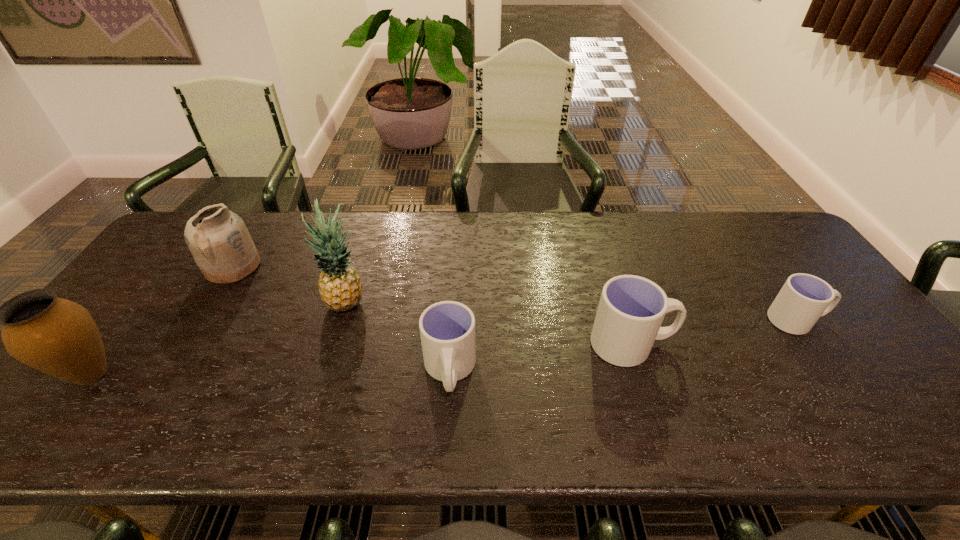
Where is `vacant area between the second object from right to left and the leftmost cup`? The height and width of the screenshot is (540, 960). vacant area between the second object from right to left and the leftmost cup is located at coordinates (540, 357).

At what (x,y) coordinates should I click in order to perform the action: click on free space between the second cup from right to left and the rightmost object. Please return your answer as a coordinate pair (x, y). This screenshot has width=960, height=540. Looking at the image, I should click on (714, 332).

Point out which object is positioned as the third nearest to the farthest object. Please provide its 2D coordinates. Your answer should be formatted as a tuple, i.e. [(x, y)], where the tuple contains the x and y coordinates of a point satisfying the conditions above.

[(447, 328)]

Identify which object is the nearest to the shortest object. Please provide its 2D coordinates. Your answer should be formatted as a tuple, i.e. [(x, y)], where the tuple contains the x and y coordinates of a point satisfying the conditions above.

[(631, 309)]

I want to click on cup that is the third closest one to the pottery, so click(x=804, y=298).

Choose which cup is the nearest neighbor to the fourth object from right to left. Please provide its 2D coordinates. Your answer should be formatted as a tuple, i.e. [(x, y)], where the tuple contains the x and y coordinates of a point satisfying the conditions above.

[(447, 328)]

The image size is (960, 540). I want to click on free space in the image that satisfies the following two spatial constraints: 1. with the handle on the side of the second cup from right to left; 2. with the handle on the side of the fourth object from left to right, so click(640, 371).

Where is `free region that satisfies the following two spatial constraints: 1. with the handle on the side of the second object from right to left; 2. with the handle on the side of the second tallest cup`? Image resolution: width=960 pixels, height=540 pixels. free region that satisfies the following two spatial constraints: 1. with the handle on the side of the second object from right to left; 2. with the handle on the side of the second tallest cup is located at coordinates (640, 371).